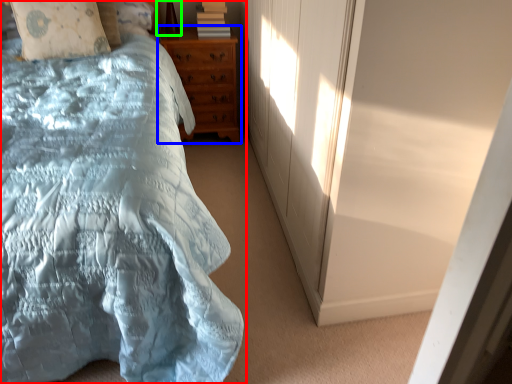
Question: Which is nearer to the bed (highlighted by a red box)? chest of drawers (highlighted by a blue box) or table lamp (highlighted by a green box).

Choices:
 (A) chest of drawers
 (B) table lamp

Answer: (A)